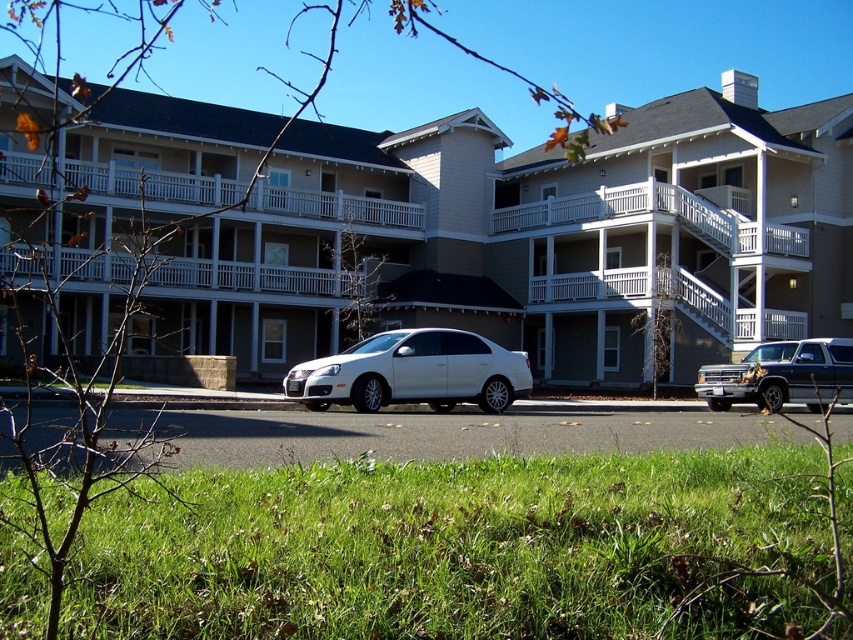
You are standing on the grassy area in front of the white matte building at center. If you walk straight towards the building, will you reach the street or the building first?

The white matte building at center is located at point (x=540, y=237), which is closer to you than the street. Therefore, walking straight towards it, you will reach the building before the street.

You are standing on the grassy area with scattered brown leaves in front of the white matte building at center. You want to take a photo of the building with your smartphone. To ensure the entire building fits in the frame, what is the minimum distance you should maintain from the building?

The white matte building at center is 28.02 meters from camera. To ensure the entire building fits in the frame, you should maintain a distance of at least 28.02 meters from the building.